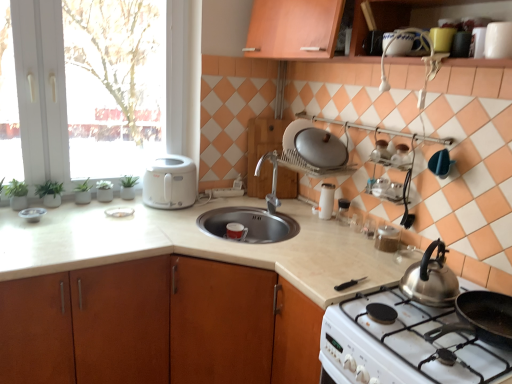
You are a GUI agent. You are given a task and a screenshot of the screen. Output one action in this format:
    pyautogui.click(x=<x>, y=<y>)
    Task: Click on the vacant area that lies to the right of metallic silver bowl at left, the 4th appliance from the front
    The width and height of the screenshot is (512, 384).
    Given the screenshot: What is the action you would take?
    pyautogui.click(x=70, y=216)